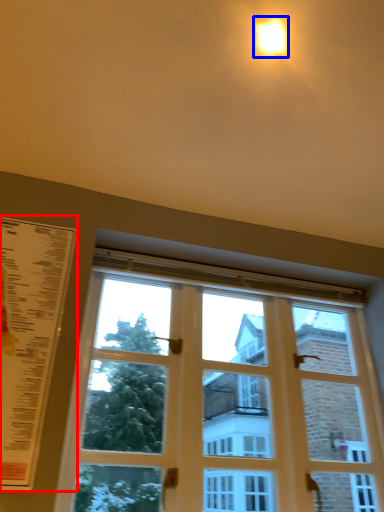
Question: Among these objects, which one is farthest to the camera, menu (highlighted by a red box) or light (highlighted by a blue box)?

Choices:
 (A) menu
 (B) light

Answer: (B)